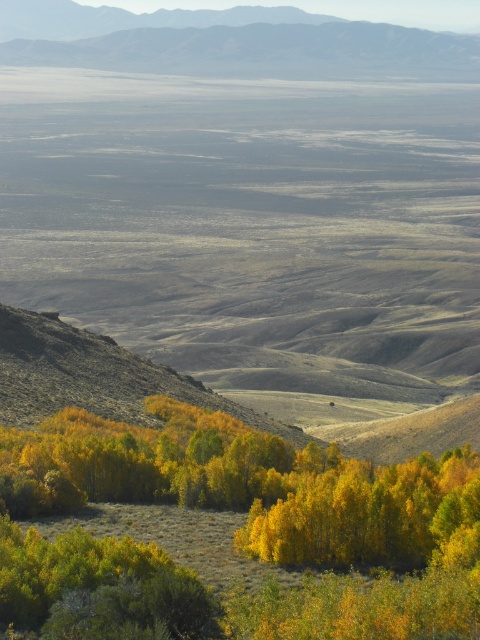
You are standing at the point marked by coordinates point (253, 486) in the image. Based on the scene description, what do you see around you?

You are surrounded by yellow leafy trees at lower left, which are part of the dense cluster of autumnal trees in the foreground of the scene.